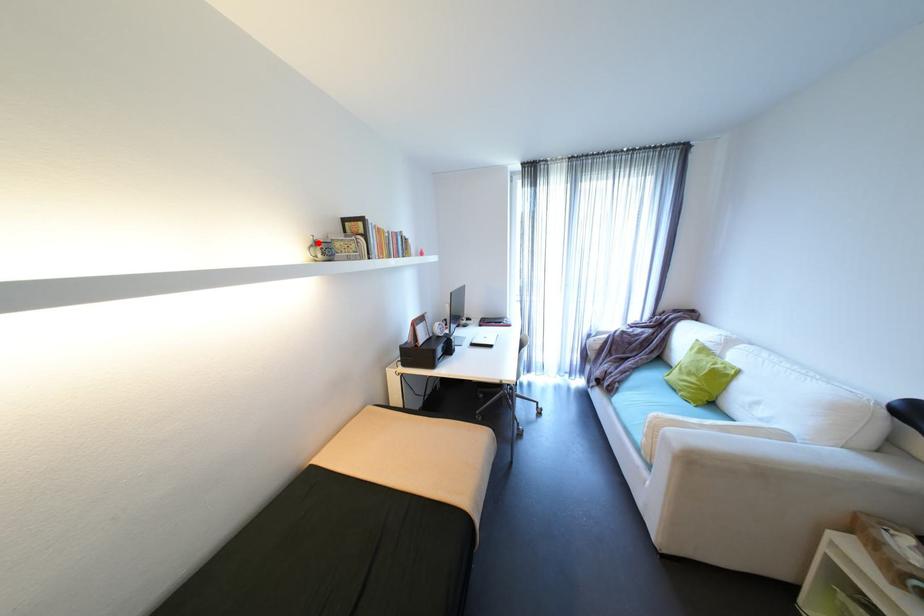
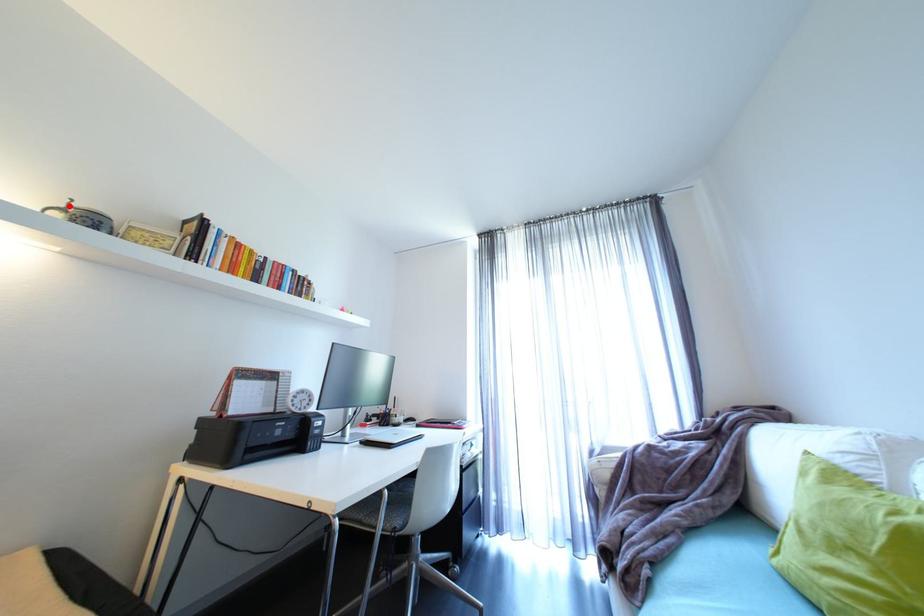
I am providing you with two images of the same scene from different viewpoints. A red point is marked on the first image and another point is marked on the second image. Does the point marked in image1 correspond to the same location as the one in image2?

Yes